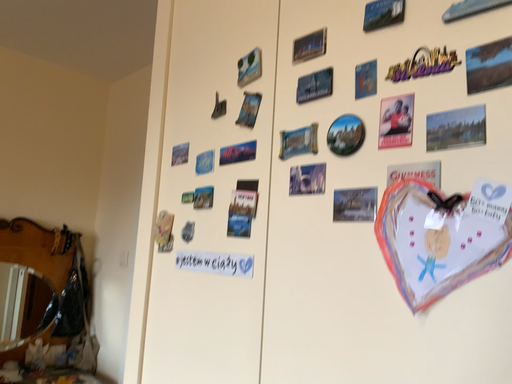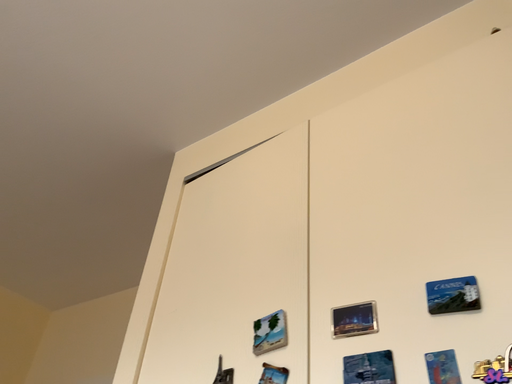
Question: Which way did the camera rotate in the video?

Choices:
 (A) rotated left
 (B) rotated right

Answer: (B)